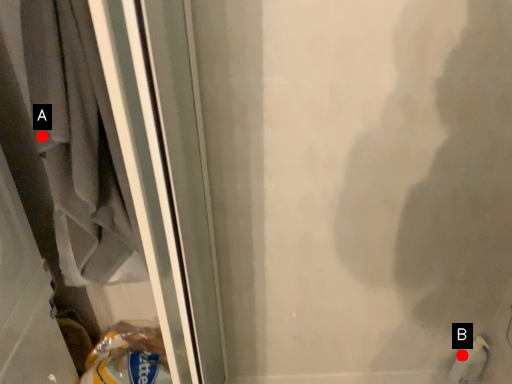
Question: Two points are circled on the image, labeled by A and B beside each circle. Which of the following is the farthest from the observer?

Choices:
 (A) A is further
 (B) B is further

Answer: (B)